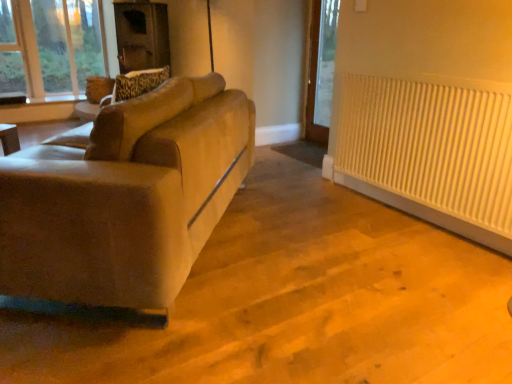
Question: Does beige fabric swivel chair at left have a greater width compared to suede-like beige couch at left?

Choices:
 (A) yes
 (B) no

Answer: (B)

Question: Is beige fabric swivel chair at left positioned before suede-like beige couch at left?

Choices:
 (A) yes
 (B) no

Answer: (B)

Question: Considering the relative sizes of beige fabric swivel chair at left and suede-like beige couch at left in the image provided, is beige fabric swivel chair at left thinner than suede-like beige couch at left?

Choices:
 (A) no
 (B) yes

Answer: (B)

Question: Does beige fabric swivel chair at left have a smaller size compared to suede-like beige couch at left?

Choices:
 (A) no
 (B) yes

Answer: (B)

Question: Is beige fabric swivel chair at left bigger than suede-like beige couch at left?

Choices:
 (A) yes
 (B) no

Answer: (B)

Question: Are beige fabric swivel chair at left and suede-like beige couch at left located far from each other?

Choices:
 (A) no
 (B) yes

Answer: (A)

Question: Is suede-like beige couch at left thinner than beige fabric swivel chair at left?

Choices:
 (A) yes
 (B) no

Answer: (B)

Question: Does suede-like beige couch at left have a greater width compared to beige fabric swivel chair at left?

Choices:
 (A) no
 (B) yes

Answer: (B)

Question: Can you see suede-like beige couch at left touching beige fabric swivel chair at left?

Choices:
 (A) yes
 (B) no

Answer: (B)

Question: Does suede-like beige couch at left appear on the left side of beige fabric swivel chair at left?

Choices:
 (A) yes
 (B) no

Answer: (A)

Question: Considering the relative sizes of suede-like beige couch at left and beige fabric swivel chair at left in the image provided, is suede-like beige couch at left bigger than beige fabric swivel chair at left?

Choices:
 (A) no
 (B) yes

Answer: (B)

Question: Are suede-like beige couch at left and beige fabric swivel chair at left located far from each other?

Choices:
 (A) yes
 (B) no

Answer: (B)

Question: Does white ribbed radiator at right come behind beige fabric swivel chair at left?

Choices:
 (A) yes
 (B) no

Answer: (A)